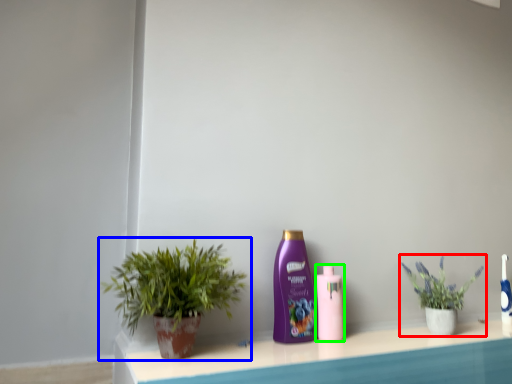
Question: Based on their relative distances, which object is nearer to houseplant (highlighted by a red box)? Choose from houseplant (highlighted by a blue box) and bottle (highlighted by a green box).

Choices:
 (A) houseplant
 (B) bottle

Answer: (B)